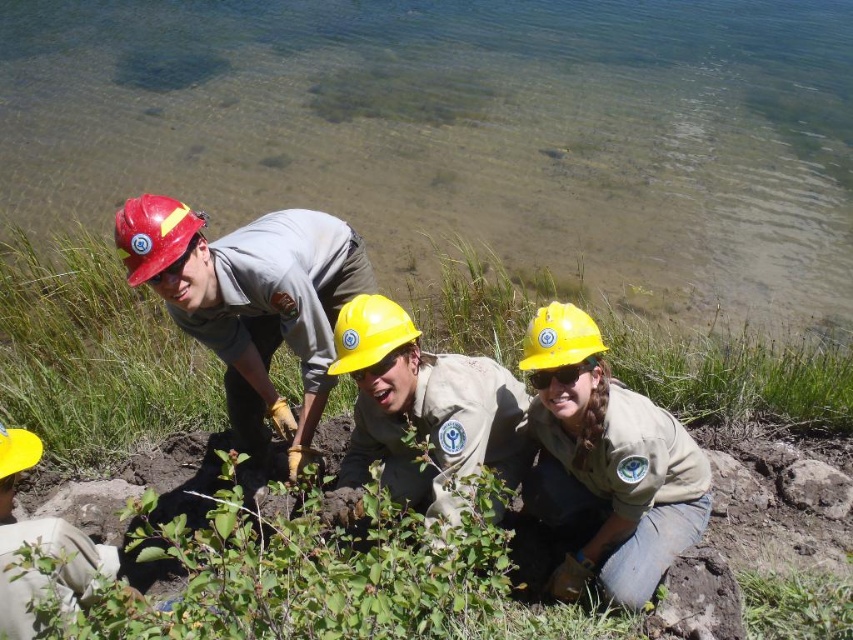
You are a safety inspector observing the scene and need to ensure proper equipment usage. Which item is positioned closer to you between the yellow matte helmet at center and the yellow matte hard hat at center?

The yellow matte helmet at center is closer to the viewer than the yellow matte hard hat at center, so the helmet is the one positioned closer to you.

You are a member of the environmental team and need to find the yellow matte helmet at center. According to the coordinates provided, where exactly is it positioned in the image?

The yellow matte helmet at center is located at point (422, 412) in the image coordinates.

You are a safety inspector checking the scene. You notice the matte yellow helmet at center and the green leafy plant at lower center. Which object is shorter?

The matte yellow helmet at center is shorter than the green leafy plant at lower center.